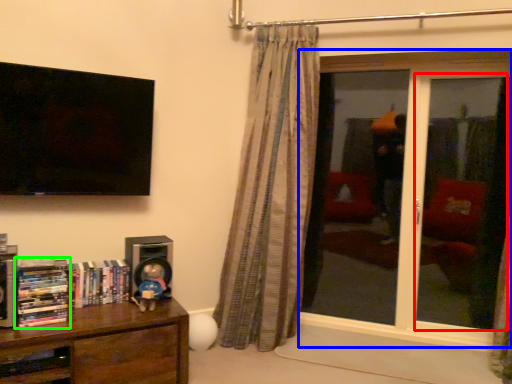
Question: Which object is positioned closest to screen door (highlighted by a red box)? Select from window (highlighted by a blue box) and book (highlighted by a green box).

Choices:
 (A) window
 (B) book

Answer: (A)